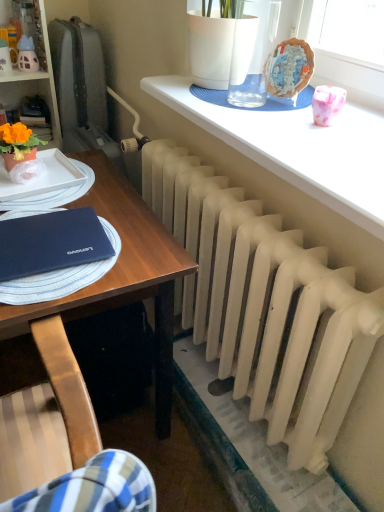
Measure the distance between point [265,321] and camera.

Point [265,321] and camera are 3.53 feet apart.

This screenshot has width=384, height=512. What do you see at coordinates (122, 274) in the screenshot?
I see `white matte desk at center` at bounding box center [122, 274].

The width and height of the screenshot is (384, 512). I want to click on orange matte flower pot at left, so click(18, 144).

Where is `white matte radiator at upper center`? white matte radiator at upper center is located at coordinates (298, 148).

Image resolution: width=384 pixels, height=512 pixels. What are the coordinates of `matte orange flower pot at left` in the screenshot? It's located at (32, 94).

What do you see at coordinates (32, 94) in the screenshot?
I see `matte orange flower pot at left` at bounding box center [32, 94].

The height and width of the screenshot is (512, 384). I want to click on white matte radiator at lower center, so click(x=266, y=305).

Is white matte desk at center inside or outside of fluffy fabric flower at upper center?

white matte desk at center is spatially situated outside fluffy fabric flower at upper center.

You are a GUI agent. You are given a task and a screenshot of the screen. Output one action in this format:
    pyautogui.click(x=<x>, y=<y>)
    Task: Click on the floral arrangement above the white matte desk at center (from a real-world perspective)
    
    Given the screenshot: What is the action you would take?
    pyautogui.click(x=289, y=68)

Consider the image. Which object is further away from the camera taking this photo, white matte desk at center or fluffy fabric flower at upper center?

fluffy fabric flower at upper center is further away from the camera.

From the image's perspective, is white matte desk at center beneath fluffy fabric flower at upper center?

Yes, from the image's perspective, white matte desk at center is beneath fluffy fabric flower at upper center.

Does point (103, 236) come closer to viewer compared to point (184, 94)?

That is True.

Based on the photo, which is behind, matte black notebook at left or white matte radiator at upper center?

matte black notebook at left is further away from the camera.

Is matte black notebook at left at the right side of white matte radiator at upper center?

No.

How different are the orientations of matte black notebook at left and white matte radiator at upper center in degrees?

3.61 degrees separate the facing orientations of matte black notebook at left and white matte radiator at upper center.

Which object is wider, orange matte flower pot at left or white matte desk at center?

With larger width is white matte desk at center.

From the image's perspective, is orange matte flower pot at left beneath white matte desk at center?

No, from the image's perspective, orange matte flower pot at left is not beneath white matte desk at center.

Are orange matte flower pot at left and white matte desk at center beside each other?

orange matte flower pot at left and white matte desk at center are clearly separated.

How many degrees apart are the facing directions of orange matte flower pot at left and white matte desk at center?

84.2 degrees separate the facing orientations of orange matte flower pot at left and white matte desk at center.

From a real-world perspective, which is physically above, orange matte flower pot at left or white matte radiator at upper center?

white matte radiator at upper center is physically above.

Is orange matte flower pot at left not within white matte radiator at upper center?

Yes.

Does orange matte flower pot at left touch white matte radiator at upper center?

orange matte flower pot at left and white matte radiator at upper center are not in contact.

Based on the photo, what's the angular difference between white matte desk at center and orange matte flower pot at left's facing directions?

There is a 84.2-degree angle between the facing directions of white matte desk at center and orange matte flower pot at left.

From a real-world perspective, who is located lower, white matte desk at center or orange matte flower pot at left?

white matte desk at center is physically lower.

Would you consider white matte desk at center to be distant from orange matte flower pot at left?

They are positioned close to each other.

Is white matte radiator at upper center completely or partially inside white matte radiator at lower center?

That's incorrect, white matte radiator at upper center is not inside white matte radiator at lower center.

How different are the orientations of white matte radiator at lower center and white matte radiator at upper center in degrees?

The angular difference between white matte radiator at lower center and white matte radiator at upper center is 0.015 degrees.

Consider the image. Considering the relative positions of white matte radiator at lower center and white matte radiator at upper center in the image provided, is white matte radiator at lower center to the left of white matte radiator at upper center from the viewer's perspective?

Yes, white matte radiator at lower center is to the left of white matte radiator at upper center.

Is white matte radiator at lower center looking in the opposite direction of white matte radiator at upper center?

That's not correct — white matte radiator at lower center is not looking away from white matte radiator at upper center.

Is matte black notebook at left shorter than white matte radiator at lower center?

Yes, matte black notebook at left is shorter than white matte radiator at lower center.

This screenshot has height=512, width=384. What are the coordinates of `notebook to the left of white matte radiator at lower center` in the screenshot? It's located at (51, 243).

Is white matte radiator at lower center a part of matte black notebook at left?

No, white matte radiator at lower center is not surrounded by matte black notebook at left.

From a real-world perspective, relative to white matte radiator at lower center, is matte black notebook at left vertically above or below?

matte black notebook at left is above white matte radiator at lower center.

The height and width of the screenshot is (512, 384). I want to click on floral arrangement located behind the white matte desk at center, so click(289, 68).

Image resolution: width=384 pixels, height=512 pixels. I want to click on table on the right of matte black notebook at left, so pyautogui.click(x=298, y=148).

Based on their spatial positions, is white matte desk at center or white matte radiator at upper center closer to matte orange flower pot at left?

white matte desk at center lies closer to matte orange flower pot at left than the other object.

From the image, which object appears to be farther from fluffy fabric flower at upper center, matte black notebook at left or matte orange flower pot at left?

matte orange flower pot at left is further to fluffy fabric flower at upper center.

Based on their spatial positions, is orange matte flower pot at left or white matte radiator at lower center further from fluffy fabric flower at upper center?

orange matte flower pot at left.

Estimate the real-world distances between objects in this image. Which object is further from matte black notebook at left, white matte desk at center or white matte radiator at upper center?

Based on the image, white matte radiator at upper center appears to be further to matte black notebook at left.

In the scene shown: When comparing their distances from white matte radiator at upper center, does white matte desk at center or matte black notebook at left seem closer?

white matte desk at center.

Estimate the real-world distances between objects in this image. Which object is closer to matte orange flower pot at left, matte black notebook at left or fluffy fabric flower at upper center?

matte black notebook at left is positioned closer to the anchor matte orange flower pot at left.

Considering their positions, is orange matte flower pot at left positioned further to white matte desk at center than white matte radiator at upper center?

Among the two, orange matte flower pot at left is located further to white matte desk at center.

Which object lies nearer to the anchor point matte orange flower pot at left, fluffy fabric flower at upper center or white matte radiator at lower center?

Among the two, fluffy fabric flower at upper center is located nearer to matte orange flower pot at left.

You are a GUI agent. You are given a task and a screenshot of the screen. Output one action in this format:
    pyautogui.click(x=<x>, y=<y>)
    Task: Click on the radiator between matte black notebook at left and fluffy fabric flower at upper center in the horizontal direction
    
    Given the screenshot: What is the action you would take?
    pyautogui.click(x=266, y=305)

This screenshot has height=512, width=384. Identify the location of notebook between orange matte flower pot at left and fluffy fabric flower at upper center from left to right. (51, 243).

Image resolution: width=384 pixels, height=512 pixels. Identify the location of houseplant between white matte radiator at lower center and matte orange flower pot at left in the front-back direction. [x=18, y=144].

Where is `floral arrangement between orange matte flower pot at left and white matte radiator at upper center from left to right`? The width and height of the screenshot is (384, 512). floral arrangement between orange matte flower pot at left and white matte radiator at upper center from left to right is located at coordinates (289, 68).